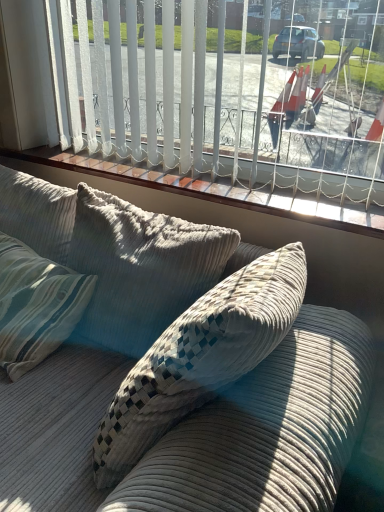
Question: Can you confirm if white vertical blinds at upper center is wider than wooden window sill at upper center?

Choices:
 (A) yes
 (B) no

Answer: (B)

Question: Is white vertical blinds at upper center not close to wooden window sill at upper center?

Choices:
 (A) no
 (B) yes

Answer: (A)

Question: Does white vertical blinds at upper center have a smaller size compared to wooden window sill at upper center?

Choices:
 (A) no
 (B) yes

Answer: (A)

Question: Is white vertical blinds at upper center at the left side of wooden window sill at upper center?

Choices:
 (A) yes
 (B) no

Answer: (B)

Question: Does white vertical blinds at upper center contain wooden window sill at upper center?

Choices:
 (A) yes
 (B) no

Answer: (B)

Question: Is wooden window sill at upper center situated inside white vertical blinds at upper center or outside?

Choices:
 (A) inside
 (B) outside

Answer: (B)

Question: Is wooden window sill at upper center wider or thinner than white vertical blinds at upper center?

Choices:
 (A) thin
 (B) wide

Answer: (B)

Question: From a real-world perspective, is wooden window sill at upper center physically located above or below white vertical blinds at upper center?

Choices:
 (A) above
 (B) below

Answer: (B)

Question: Is wooden window sill at upper center taller or shorter than white vertical blinds at upper center?

Choices:
 (A) short
 (B) tall

Answer: (A)

Question: Considering the positions of white vertical blinds at upper center and wooden window sill at upper center in the image, is white vertical blinds at upper center taller or shorter than wooden window sill at upper center?

Choices:
 (A) tall
 (B) short

Answer: (A)

Question: In the image, is white vertical blinds at upper center on the left side or the right side of wooden window sill at upper center?

Choices:
 (A) left
 (B) right

Answer: (B)

Question: Would you say white vertical blinds at upper center is inside or outside wooden window sill at upper center?

Choices:
 (A) inside
 (B) outside

Answer: (B)

Question: Relative to wooden window sill at upper center, is white vertical blinds at upper center in front or behind?

Choices:
 (A) behind
 (B) front

Answer: (B)

Question: Considering their positions, is white vertical blinds at upper center located in front of or behind corduroy couch at center?

Choices:
 (A) front
 (B) behind

Answer: (B)

Question: From the image's perspective, is white vertical blinds at upper center positioned above or below corduroy couch at center?

Choices:
 (A) below
 (B) above

Answer: (B)